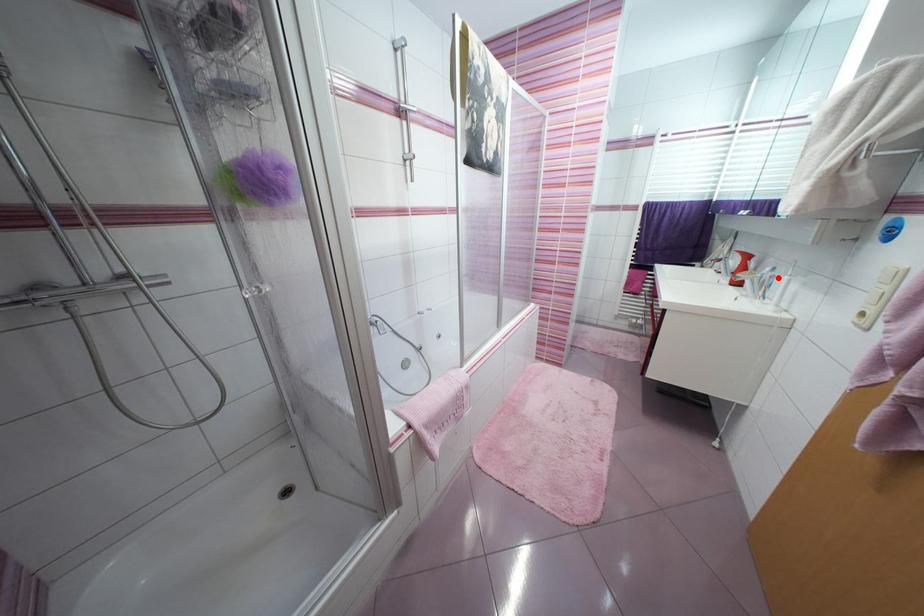
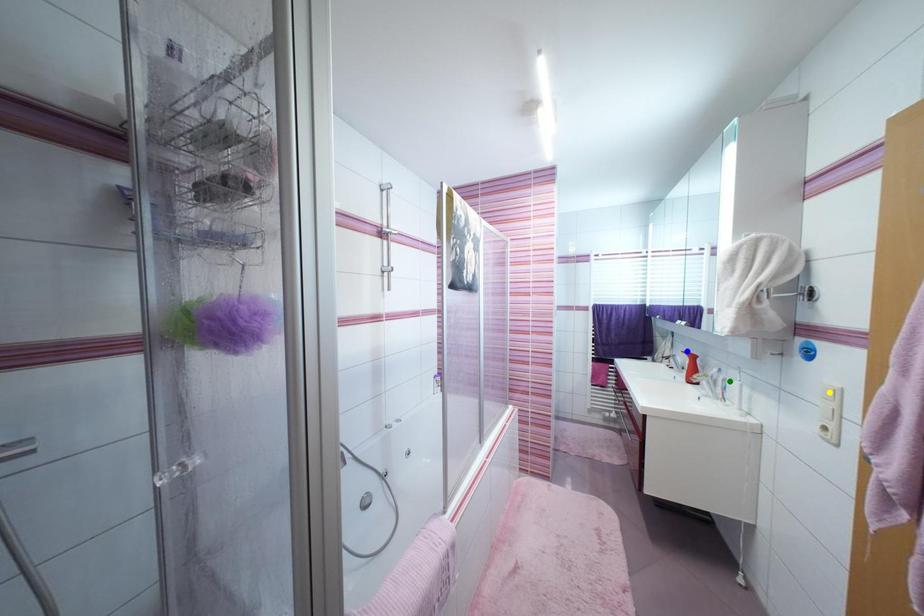
Question: I am providing you with two images of the same scene from different viewpoints. A red point is marked on the first image. You are given multiple points on the second image. Which mark in image 2 goes with the point in image 1?

Choices:
 (A) green point
 (B) yellow point
 (C) blue point

Answer: (A)